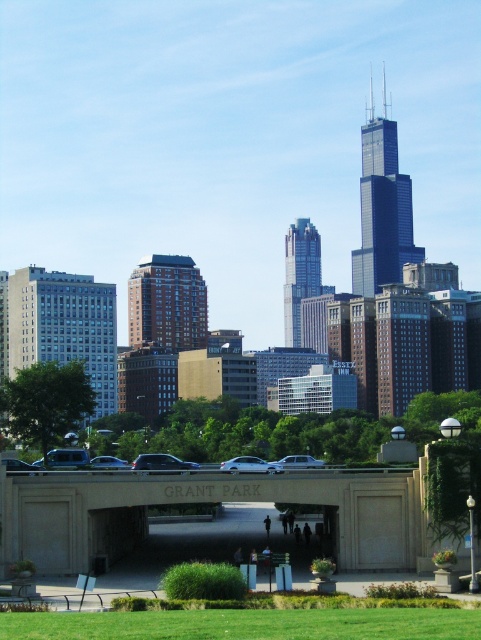
You are a pedestrian standing at the entrance of GRANT PARK and see both the shiny black sedan at center and the white matte car at center. Which car is positioned more to your left side?

The shiny black sedan at center is positioned to the left of the white matte car at center, so it is more to your left side.

You are standing in the park and want to take a photo of both the shiny black sedan at center and the silver metallic sedan at center. Which sedan should you focus on first to ensure both are in the frame?

You should focus on the shiny black sedan at center first since it is closer to you, allowing the silver metallic sedan at center to stay in the frame behind it.